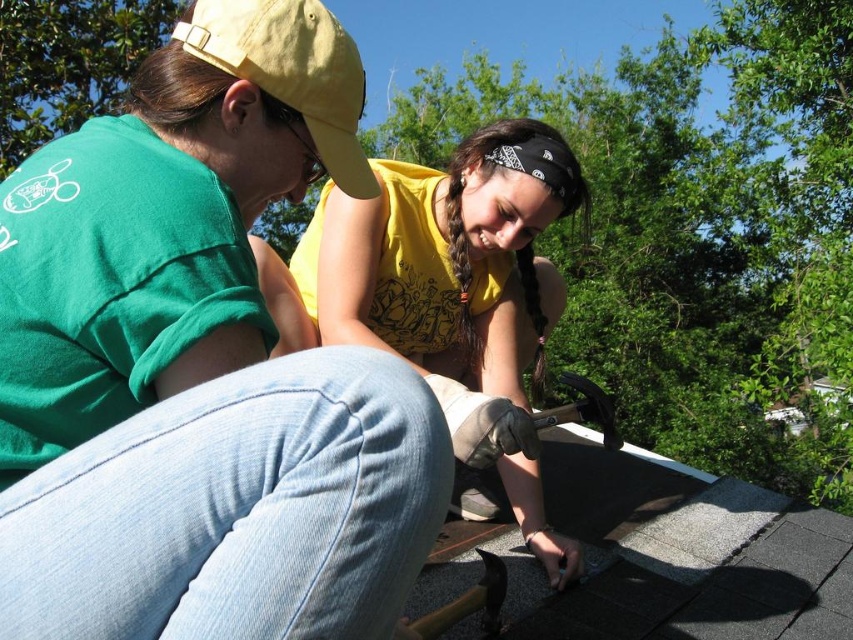
Based on the scene described, which object is taller between the yellow matte shirt at center and the yellow fabric baseball cap at upper left?

The yellow matte shirt at center is taller than the yellow fabric baseball cap at upper left according to the description.

You are a safety inspector checking the roof work area. You notice the yellow fabric baseball cap at upper left and the yellow matte shirt at center. According to safety protocols, hard hats and safety gear must be worn at all times. Which object indicates a safety violation?

The yellow fabric baseball cap at upper left indicates a safety violation because it is not a hard hat and is behind the yellow matte shirt at center, suggesting it is not properly worn or secured.

You are a safety inspector checking the roof for proper equipment visibility. You notice the matte yellow cap at upper left and the yellow matte shirt at center. Which piece of equipment is more visible to someone looking from below the roof?

The matte yellow cap at upper left is closer to the viewer than the yellow matte shirt at center, so it is more visible from below the roof.